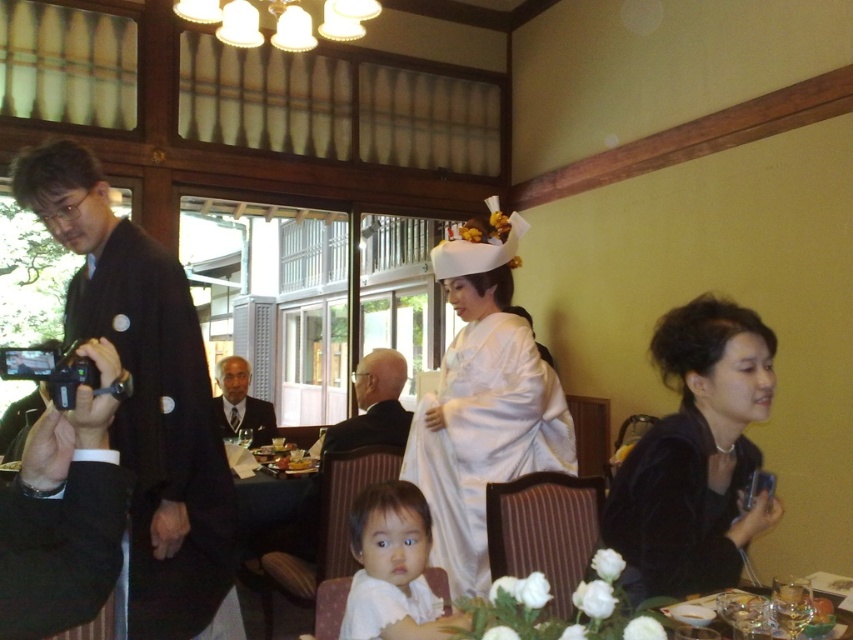
You are a photographer at the event and want to capture a closeup of the black velvet dress at lower right. According to the coordinates provided, where should you aim your camera?

The black velvet dress at lower right is located at coordinates point (695, 456). Aim your camera there to capture the closeup.

You are standing at the point marked by coordinates point (x=373, y=404) in the image. What object are you directly facing?

The point (x=373, y=404) corresponds to the dark brown suit at center, so you are directly facing the dark brown suit at center.

You are a photographer at the event and need to position two guests for a group photo. The guests are wearing the black kimono at left and the black velvet dress at lower right. Since you want to avoid having one guest block the other, which guest should stand in front?

The black velvet dress at lower right should stand in front because the black kimono at left is much taller and could block the view of the shorter guest in the black velvet dress at lower right.